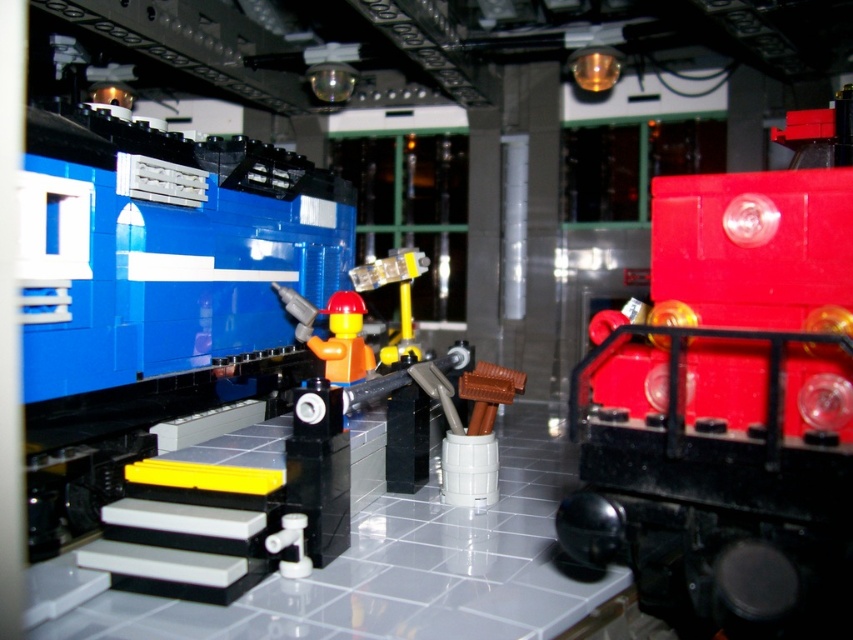
You are standing at the train station and want to know which of the two points, point (686, 188) or point (392, 349), is closer to you. Based on the scene, can you determine this?

Point (686, 188) is closer to the viewer than point (392, 349).

You are a visitor at the LEGO train station and want to know if the shiny red train at right can fit through a doorway that is the same height as the yellow matte figure at center. Can it?

The shiny red train at right is taller than the yellow matte figure at center, so it cannot fit through the doorway which is the same height as the yellow matte figure at center.